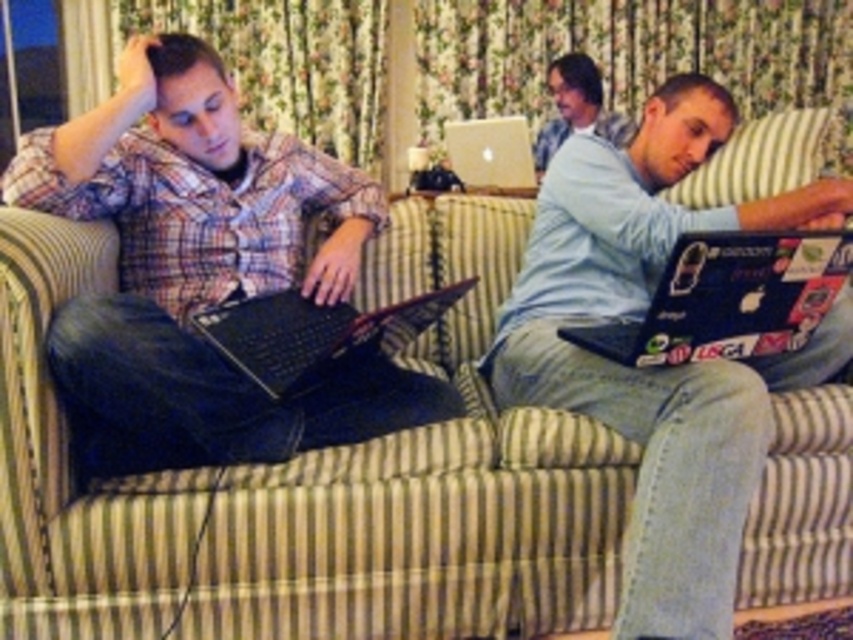
How much distance is there between shiny blue laptop at center and silver metallic laptop at center?

1.54 meters

Is shiny blue laptop at center taller than silver metallic laptop at center?

Indeed, shiny blue laptop at center has a greater height compared to silver metallic laptop at center.

The height and width of the screenshot is (640, 853). What do you see at coordinates (660, 365) in the screenshot?
I see `shiny blue laptop at center` at bounding box center [660, 365].

Where is `shiny blue laptop at center`? The width and height of the screenshot is (853, 640). shiny blue laptop at center is located at coordinates (660, 365).

Is black matte laptop at center positioned before matte gray sweater at center?

Yes.

Which is in front, point (253, 380) or point (561, 134)?

Point (253, 380) is more forward.

In order to click on black matte laptop at center in this screenshot , I will do `click(314, 333)`.

Can you confirm if sticker-covered laptop at right is wider than black matte laptop at center?

In fact, sticker-covered laptop at right might be narrower than black matte laptop at center.

Image resolution: width=853 pixels, height=640 pixels. What are the coordinates of `sticker-covered laptop at right` in the screenshot? It's located at (729, 298).